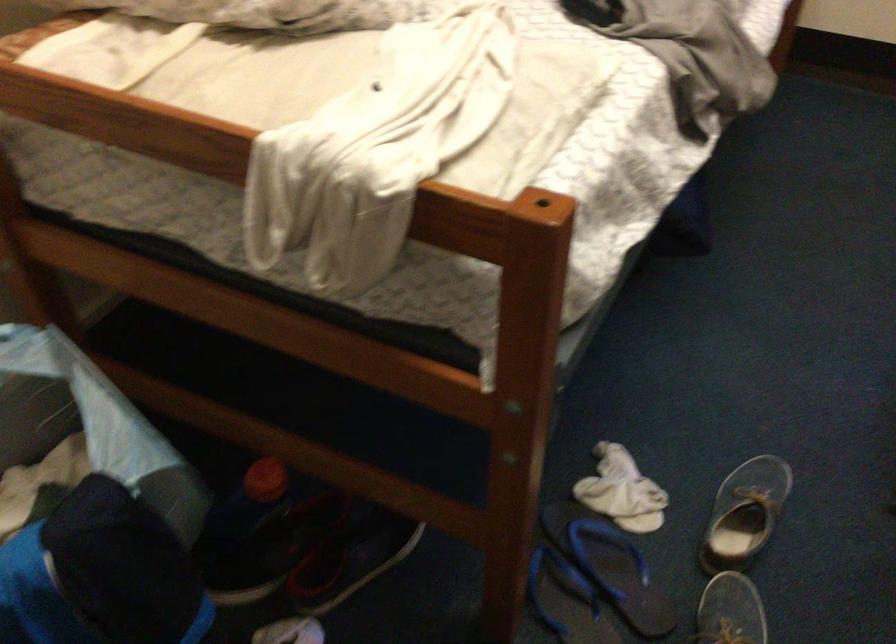
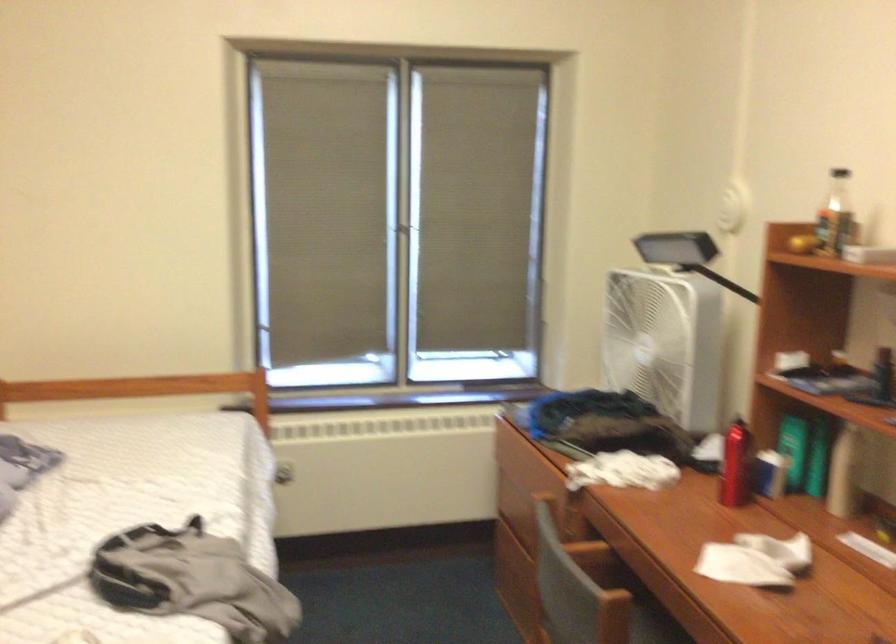
Based on the continuous images, in which direction is the camera rotating?

The rotation direction of the camera is right-up.